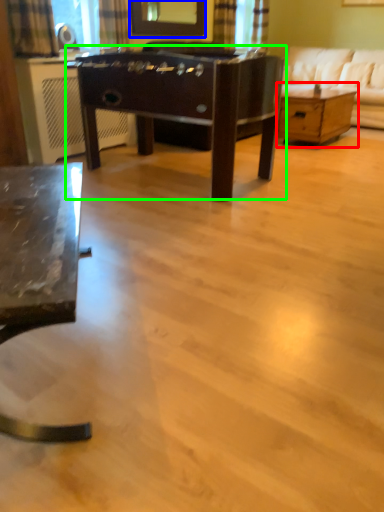
Question: Which object is positioned farthest from table (highlighted by a red box)? Select from mirror (highlighted by a blue box) and table (highlighted by a green box).

Choices:
 (A) mirror
 (B) table

Answer: (B)